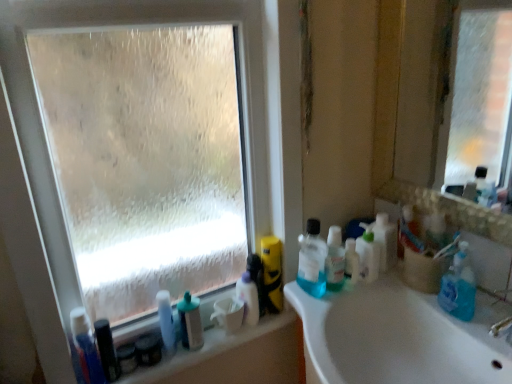
Question: In terms of size, does translucent plastic bottles at right, the fourth cleaning product in the left-to-right sequence, appear bigger or smaller than translucent plastic mouthwash at right, the second mouthwash in the bottom-to-top sequence?

Choices:
 (A) small
 (B) big

Answer: (B)

Question: Based on their positions, is translucent plastic bottles at right, the fourth cleaning product in the left-to-right sequence, located to the left or right of translucent plastic mouthwash at right, placed as the first mouthwash when sorted from top to bottom?

Choices:
 (A) left
 (B) right

Answer: (B)

Question: Which object is the closest to the white plastic bottles at lower left?

Choices:
 (A) translucent plastic bottles at right, the first toiletry viewed from the right
 (B) white glossy spray bottle at lower center, arranged as the third toiletry when viewed from the right
 (C) blue plastic toothbrush at lower left, which is the 1th cleaning product from left to right
 (D) translucent plastic bottles at right, the fourth cleaning product in the left-to-right sequence
 (E) transparent frosted glass at upper left

Answer: (B)

Question: Estimate the real-world distances between objects in this image. Which object is closer to the translucent plastic bottle at lower left, which is counted as the fourth toiletry, starting from the right?

Choices:
 (A) blue plastic toothbrush at lower left, which is the 5th cleaning product in right-to-left order
 (B) translucent plastic mouthwash at right, acting as the first mouthwash starting from the right
 (C) translucent plastic mouthwash at lower center, which ranks as the 2th mouthwash in top-to-bottom order
 (D) translucent plastic bottles at right, the first toiletry viewed from the right
 (E) white plastic bottles at lower left

Answer: (C)